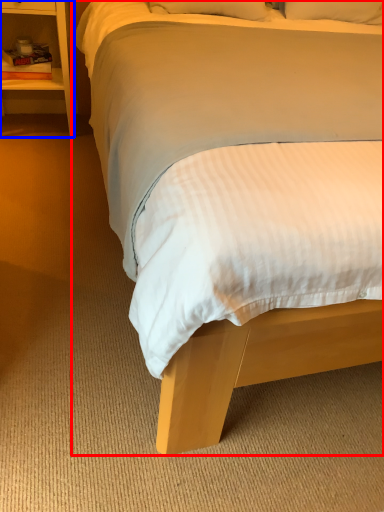
Question: Which object is closer to the camera taking this photo, bed (highlighted by a red box) or nightstand (highlighted by a blue box)?

Choices:
 (A) bed
 (B) nightstand

Answer: (A)